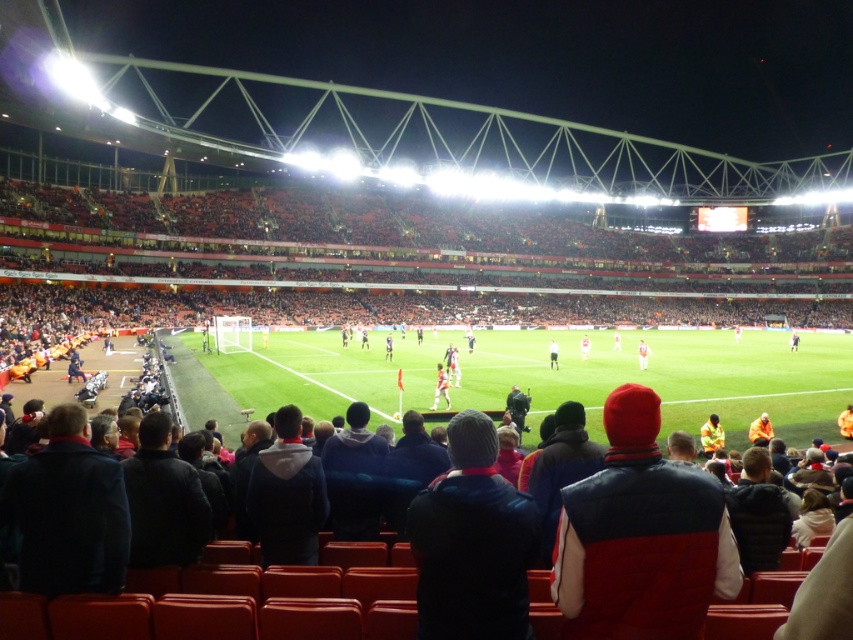
Question: Does white jersey at center have a smaller size compared to blue fabric jacket at center?

Choices:
 (A) no
 (B) yes

Answer: (B)

Question: Which point appears farthest from the camera in this image?

Choices:
 (A) (641, 356)
 (B) (390, 339)

Answer: (B)

Question: Which object is closer to the camera taking this photo?

Choices:
 (A) blue fabric jacket at center
 (B) white jersey at center
 (C) orange jersey at center
 (D) green grass football field at center

Answer: (D)

Question: Does white jersey at center lie behind orange jersey at center?

Choices:
 (A) no
 (B) yes

Answer: (A)

Question: Does white jersey at center appear on the right side of white fabric shirt at center?

Choices:
 (A) yes
 (B) no

Answer: (B)

Question: Which point appears closest to the camera in this image?

Choices:
 (A) (640, 353)
 (B) (439, 369)
 (C) (795, 410)

Answer: (B)